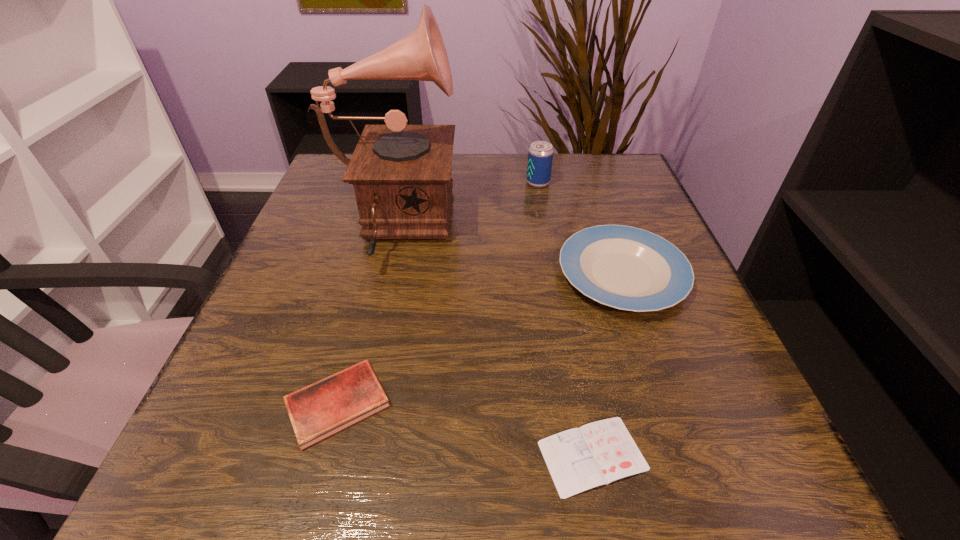
This screenshot has width=960, height=540. I want to click on the tallest object, so click(401, 174).

Where is `beer can`? The width and height of the screenshot is (960, 540). beer can is located at coordinates (540, 156).

This screenshot has height=540, width=960. I want to click on plate, so click(627, 268).

Where is `the taller diary`? the taller diary is located at coordinates (317, 411).

Locate an element on the screen. The height and width of the screenshot is (540, 960). the fourth tallest object is located at coordinates 317,411.

Locate an element on the screen. the right diary is located at coordinates (598, 453).

At what (x,y) coordinates should I click in order to perform the action: click on the shortest object. Please return your answer as a coordinate pair (x, y). This screenshot has height=540, width=960. Looking at the image, I should click on (598, 453).

Locate an element on the screen. Image resolution: width=960 pixels, height=540 pixels. vacant area situated 0.380m on the horn of the record player is located at coordinates (633, 227).

The width and height of the screenshot is (960, 540). I want to click on vacant space located 0.060m on the front of the second tallest object, so click(x=541, y=203).

Identify the location of vacant point located on the back of the plate. (598, 206).